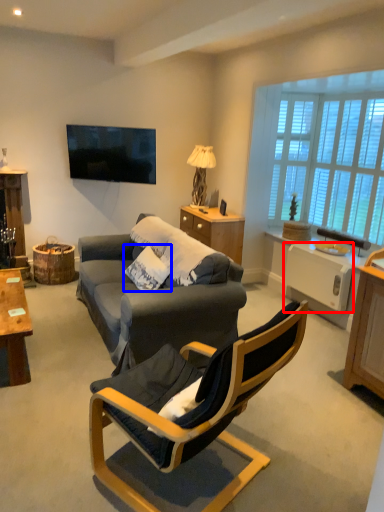
Question: Among these objects, which one is nearest to the camera, appliance (highlighted by a red box) or pillow (highlighted by a blue box)?

Choices:
 (A) appliance
 (B) pillow

Answer: (B)